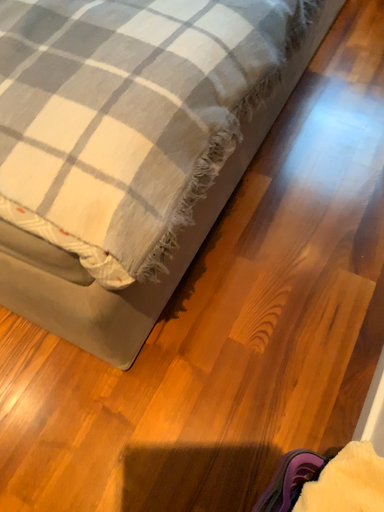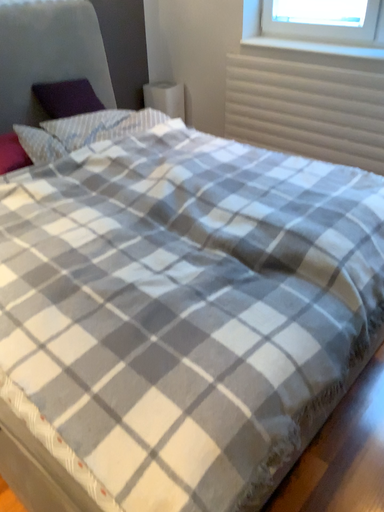
Question: Which way did the camera rotate in the video?

Choices:
 (A) rotated downward
 (B) rotated upward

Answer: (B)